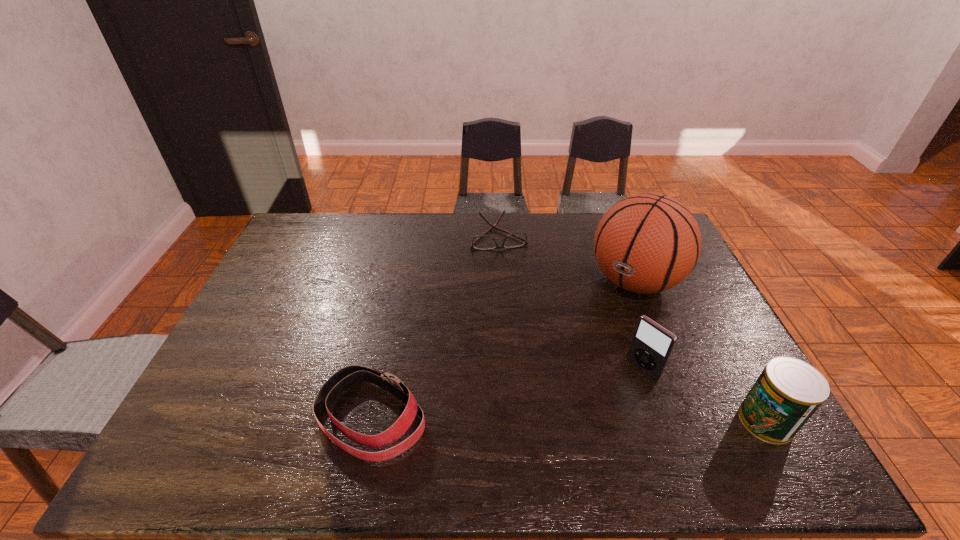
In the image, there is a desktop. Find the location of `vacant space at the near right corner`. vacant space at the near right corner is located at coordinates (710, 400).

The height and width of the screenshot is (540, 960). In order to click on free spot between the iPod and the spectacles in this screenshot , I will do `click(570, 302)`.

Where is `free space between the tallest object and the shortest object`? Image resolution: width=960 pixels, height=540 pixels. free space between the tallest object and the shortest object is located at coordinates (566, 259).

What are the coordinates of `blank region between the leftmost object and the can` in the screenshot? It's located at (568, 419).

Locate an element on the screen. Image resolution: width=960 pixels, height=540 pixels. free space between the second farthest object and the farthest object is located at coordinates (566, 259).

Identify the location of free space between the tallest object and the can. The width and height of the screenshot is (960, 540). (700, 351).

Identify the location of vacant area that lies between the basketball and the dog collar. (503, 349).

The height and width of the screenshot is (540, 960). Identify the location of free spot between the farthest object and the can. (633, 328).

This screenshot has width=960, height=540. Identify the location of unoccupied area between the leftmost object and the can. (568, 419).

Where is `object that can be found as the closest to the farthest object`? This screenshot has height=540, width=960. object that can be found as the closest to the farthest object is located at coordinates (646, 243).